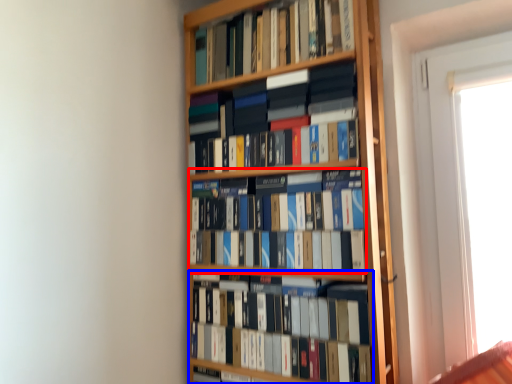
Question: Which object is closer to the camera taking this photo, book (highlighted by a red box) or book (highlighted by a blue box)?

Choices:
 (A) book
 (B) book

Answer: (B)